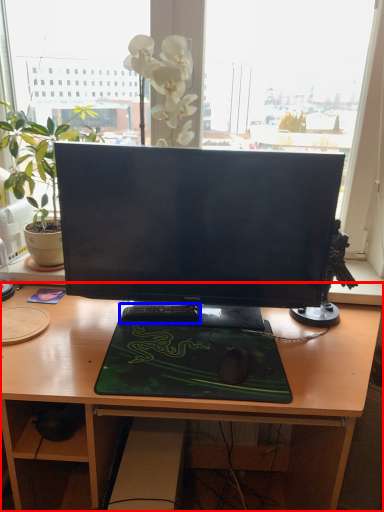
Question: Which point is closer to the camera, desk (highlighted by a red box) or laptop keyboard (highlighted by a blue box)?

Choices:
 (A) desk
 (B) laptop keyboard

Answer: (A)